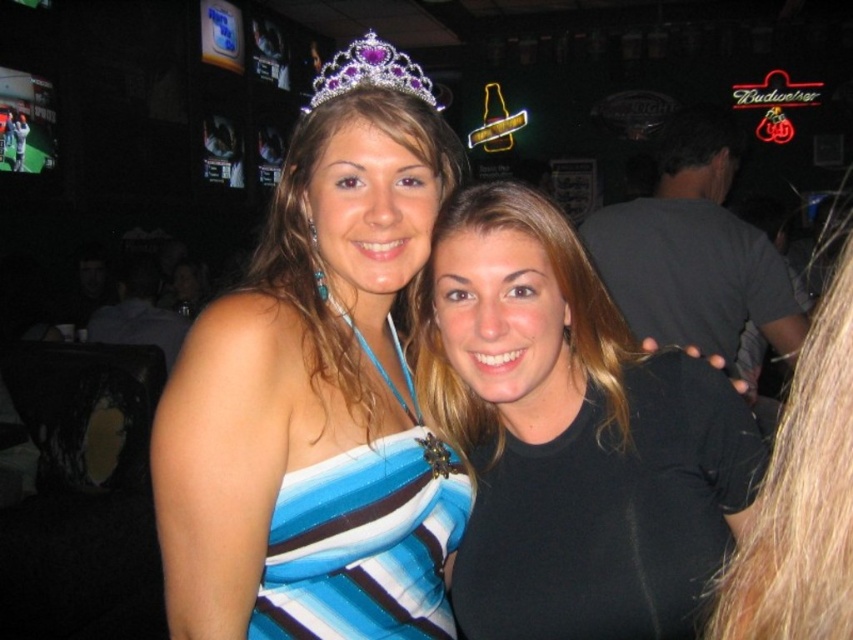
Question: From the image, what is the correct spatial relationship of blue satin dress at center in relation to blue striped fabric dress at center?

Choices:
 (A) below
 (B) above

Answer: (B)

Question: Which object appears closest to the camera in this image?

Choices:
 (A) purple crystal tiara at upper center
 (B) blue striped fabric dress at center

Answer: (B)

Question: Is blue satin dress at center smaller than purple crystal tiara at upper center?

Choices:
 (A) no
 (B) yes

Answer: (A)

Question: Which point appears farthest from the camera in this image?

Choices:
 (A) (236, 352)
 (B) (477, 548)
 (C) (302, 608)
 (D) (379, 86)

Answer: (B)

Question: Which object appears farthest from the camera in this image?

Choices:
 (A) blue satin dress at center
 (B) dark gray t-shirt at center
 (C) black matte shirt at center

Answer: (B)

Question: Does blue satin dress at center appear on the right side of blue striped fabric dress at center?

Choices:
 (A) yes
 (B) no

Answer: (B)